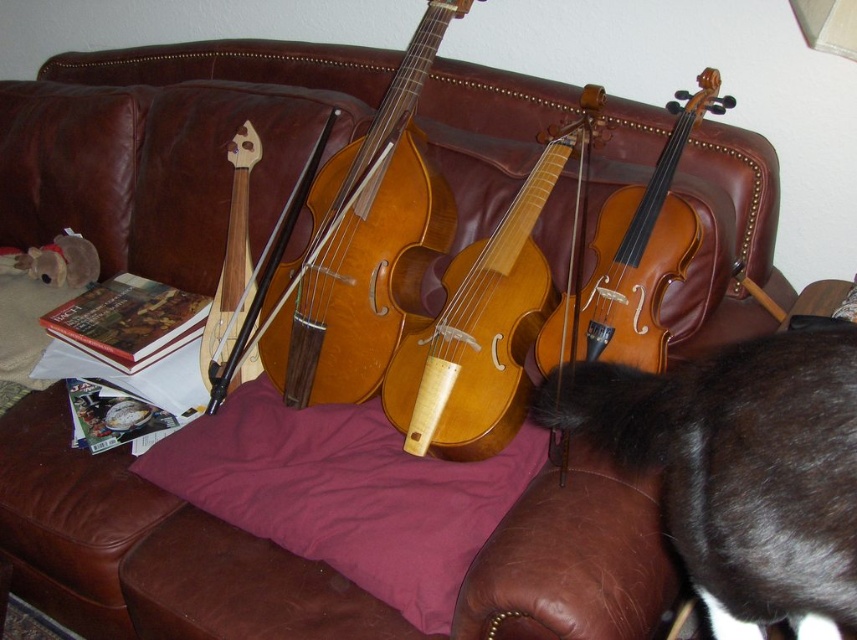
You are standing in front of a brown leather couch with a maroon cushion. On the cushion are three stringed instruments arranged from left to right as cello, viola, and violin. There is a point marked at coordinates (364, 248). Based on the scene description, which instrument is closest to this point?

The point at (364, 248) indicates the light brown wood cello at center, so the cello is closest to this point.

You are arranging a living room and want to place the purple cotton pillow at center and the light brown wood violin at center in a way that they are visible from the entrance. Given their current positions, which object is closer to the entrance?

The light brown wood violin at center is closer to the entrance because the purple cotton pillow at center is located below it, meaning the violin is positioned in front of the pillow from the entrance perspective.